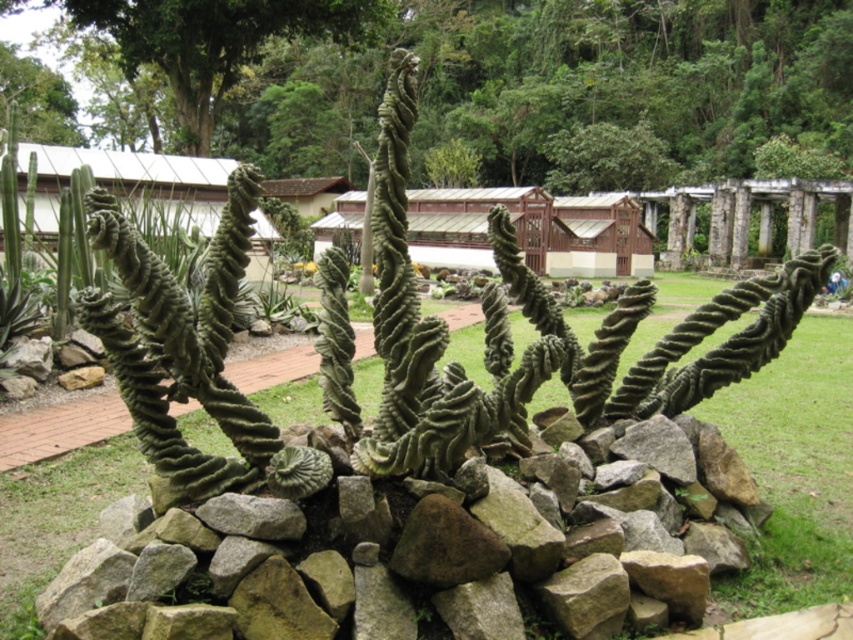
Is green textured tree at upper center wider than green grass at center?

Yes.

Does point (645, 49) lie behind point (845, 541)?

Yes, it is.

Between point (744, 156) and point (216, 438), which one is positioned behind?

Point (744, 156)

Identify the location of green textured tree at upper center. [566, 84].

Is green textured tree at upper center thinner than green leafy tree at upper left?

No, green textured tree at upper center is not thinner than green leafy tree at upper left.

Which of these two, green textured tree at upper center or green leafy tree at upper left, stands taller?

With more height is green textured tree at upper center.

Does point (770, 42) come behind point (97, 0)?

Yes, it is behind point (97, 0).

Locate an element on the screen. green textured tree at upper center is located at coordinates (566, 84).

Does point (86, 525) lie in front of point (108, 24)?

Yes, it is in front of point (108, 24).

Where is `green grass at center`? The width and height of the screenshot is (853, 640). green grass at center is located at coordinates (798, 461).